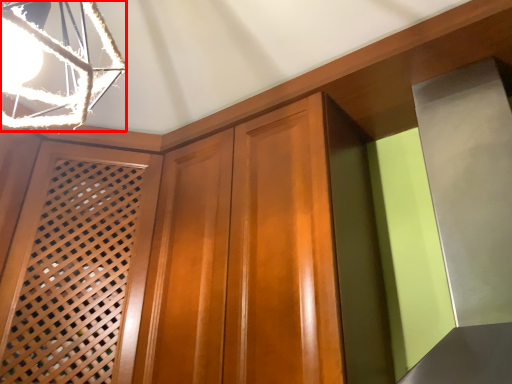
Question: Observing the image, what is the correct spatial positioning of lamp (annotated by the red box) in reference to screen door?

Choices:
 (A) left
 (B) right

Answer: (B)